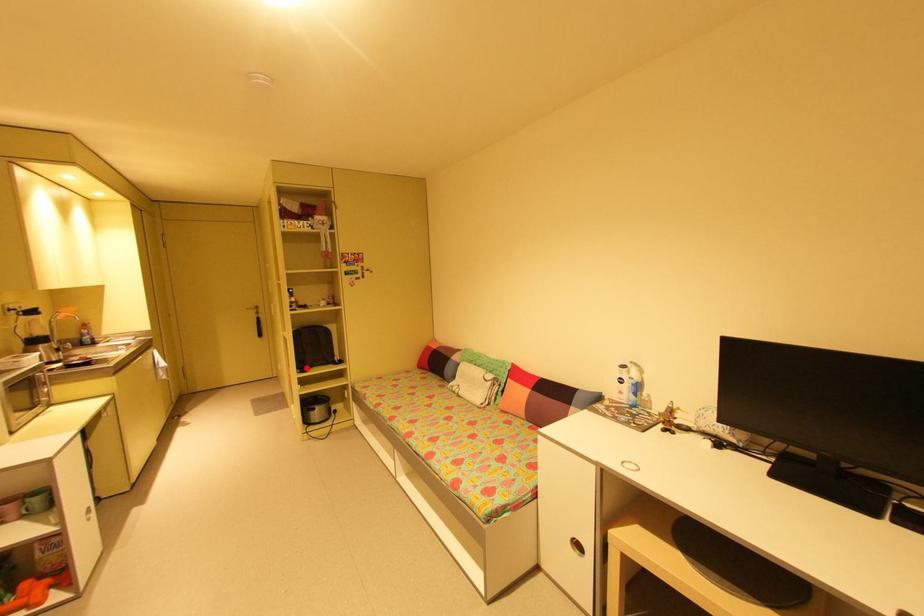
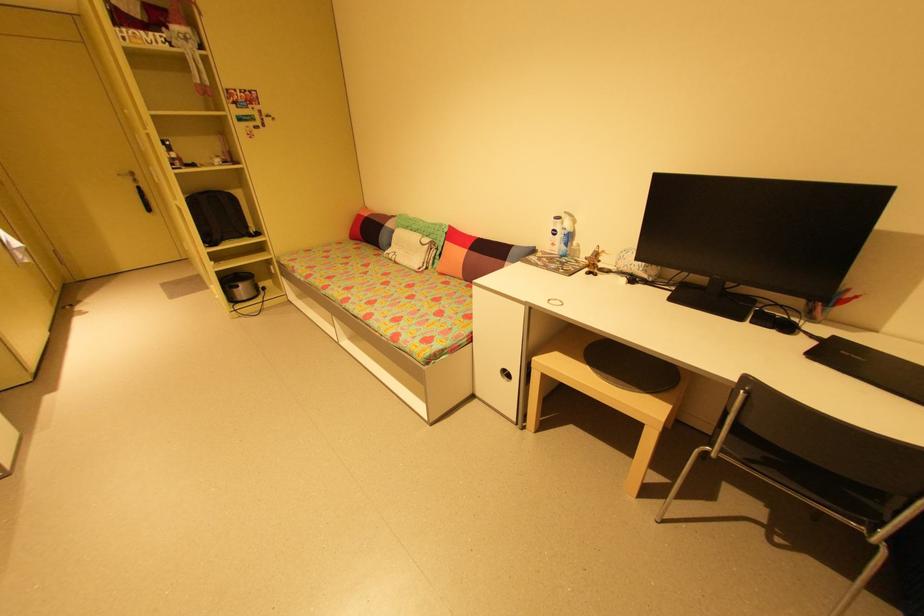
Where in the second image is the point corresponding to the highlighted location from the first image?

(215, 241)